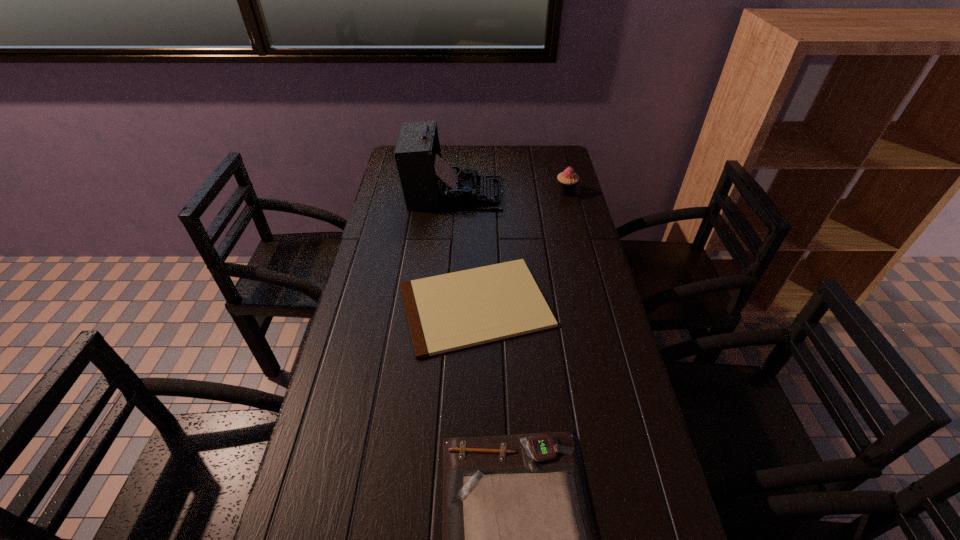
Locate an element on the screen. Image resolution: width=960 pixels, height=540 pixels. cupcake positioned at the right edge is located at coordinates (568, 180).

This screenshot has width=960, height=540. Identify the location of clipboard that is at the right edge. (452, 311).

Find the location of a particular element. This screenshot has height=540, width=960. vacant area at the far edge is located at coordinates (450, 162).

Find the location of `free spot at the left edge of the desktop`. free spot at the left edge of the desktop is located at coordinates (409, 236).

This screenshot has width=960, height=540. In the image, there is a desktop. What are the coordinates of `free space at the right edge` in the screenshot? It's located at (536, 179).

Locate an element on the screen. This screenshot has height=540, width=960. free point between the typewriter and the rightmost object is located at coordinates (511, 193).

Where is `free area in between the second tallest object and the typewriter`? The height and width of the screenshot is (540, 960). free area in between the second tallest object and the typewriter is located at coordinates (511, 193).

The image size is (960, 540). I want to click on free space between the tallest object and the rightmost object, so click(511, 193).

Where is `vacant space that's between the second tallest object and the typewriter`? The image size is (960, 540). vacant space that's between the second tallest object and the typewriter is located at coordinates (511, 193).

Identify the location of empty space that is in between the farther clipboard and the tallest object. Image resolution: width=960 pixels, height=540 pixels. (465, 249).